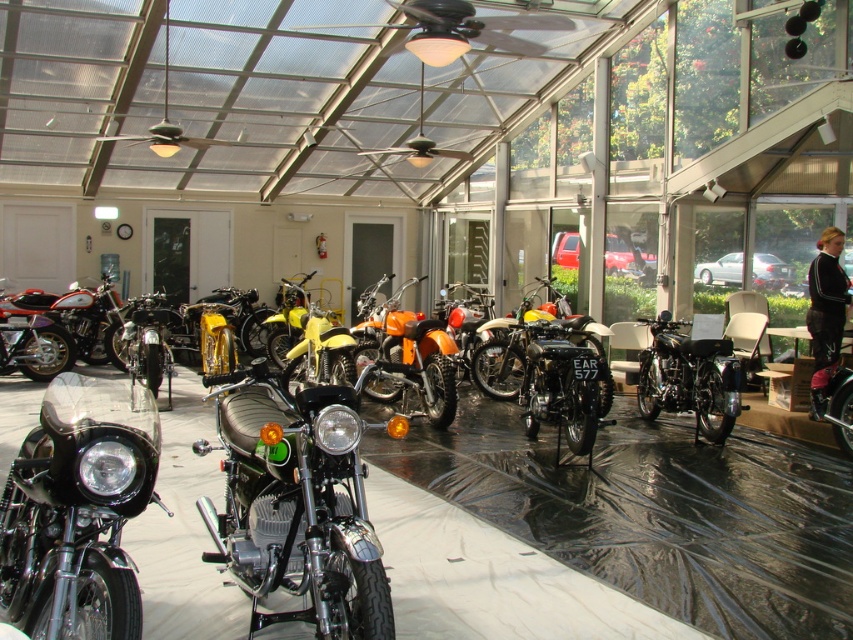
You are at the motorcycle exhibition and want to take a photo of both the black shiny motorcycle at center and the shiny black motorcycle at center. Since you have a wide angle lens, which motorcycle should you stand closer to in order to capture both in the frame?

You should stand closer to the shiny black motorcycle at center because it is smaller than the black shiny motorcycle at center, allowing you to fit both into the frame more easily.

You are a photographer standing at the center of the exhibition hall. You want to take a photo that includes both the point at [38,444] and the point at [35,291]. Which point should you focus on to ensure both are in sharp focus?

You should focus on the point that is closer to the camera, which is point [38,444], because the depth of field will naturally include the farther point [35,291] in acceptable focus when focusing on the closer one.